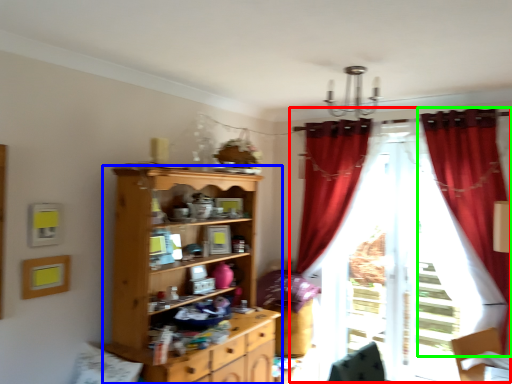
Question: Which is nearer to the curtain (highlighted by a red box)? cupboard (highlighted by a blue box) or curtain (highlighted by a green box).

Choices:
 (A) cupboard
 (B) curtain

Answer: (B)